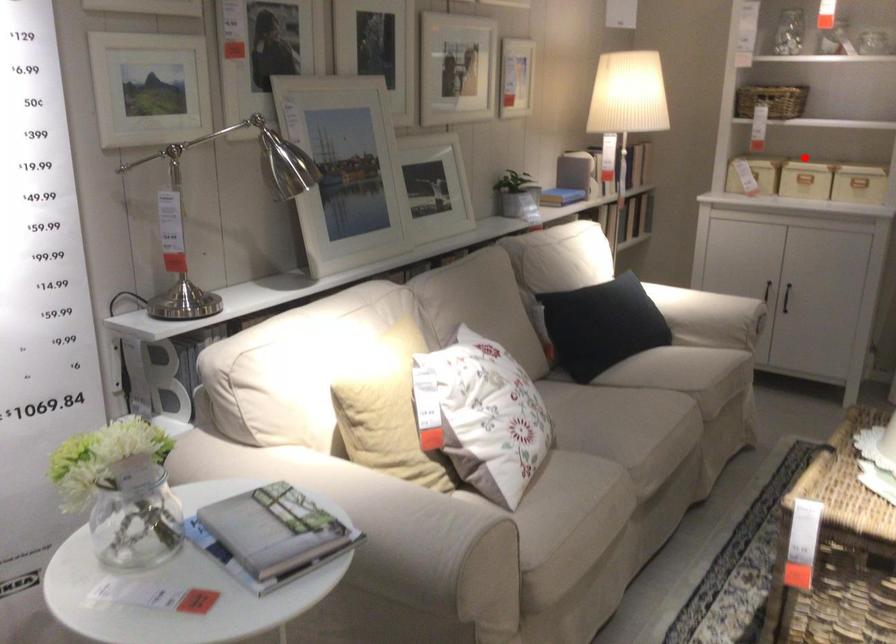
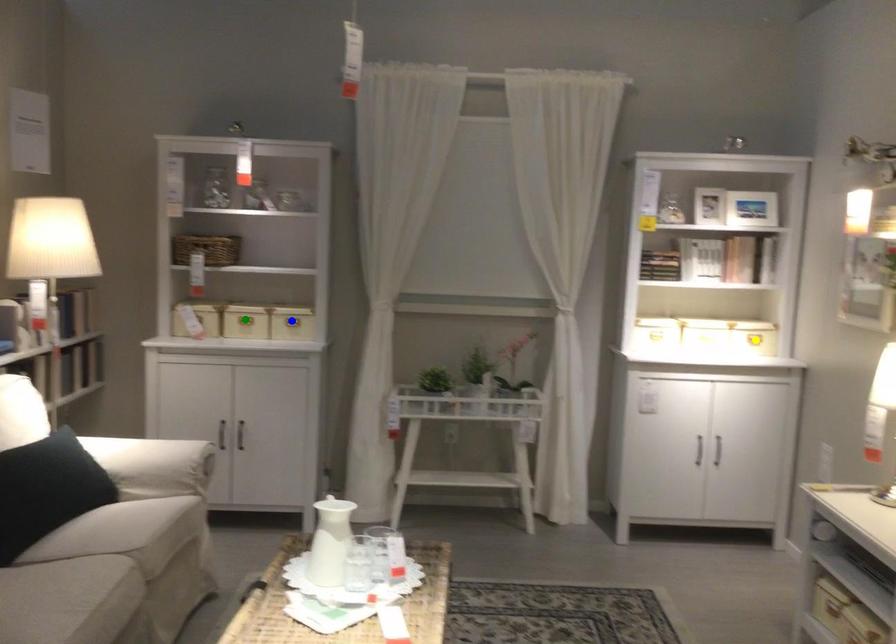
Question: I am providing you with two images of the same scene from different viewpoints. A red point is marked on the first image. You are given multiple points on the second image. In image 2, which mark is for the same physical point as the one in image 1?

Choices:
 (A) green point
 (B) blue point
 (C) yellow point

Answer: (A)